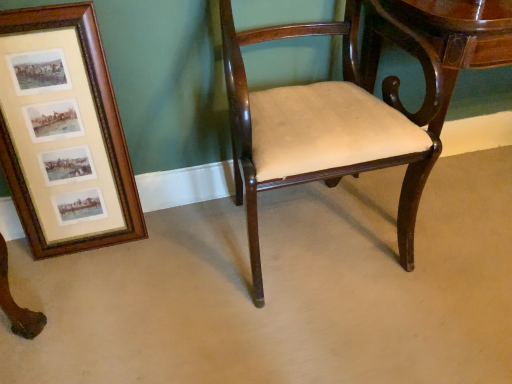
At what (x,y) coordinates should I click in order to perform the action: click on vacant region under mahogany wood chair at center (from a real-world perspective). Please return your answer as a coordinate pair (x, y). This screenshot has height=384, width=512. Looking at the image, I should click on (313, 230).